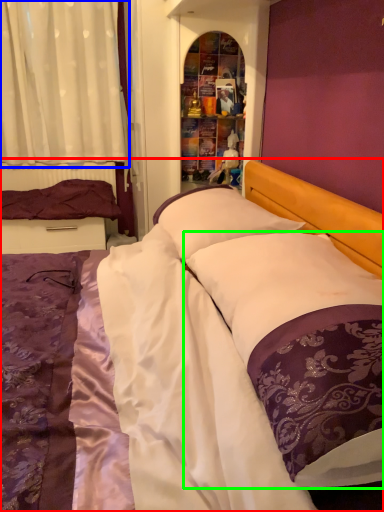
Question: Which object is positioned closest to bed (highlighted by a red box)? Select from curtain (highlighted by a blue box) and pillow (highlighted by a green box).

Choices:
 (A) curtain
 (B) pillow

Answer: (B)